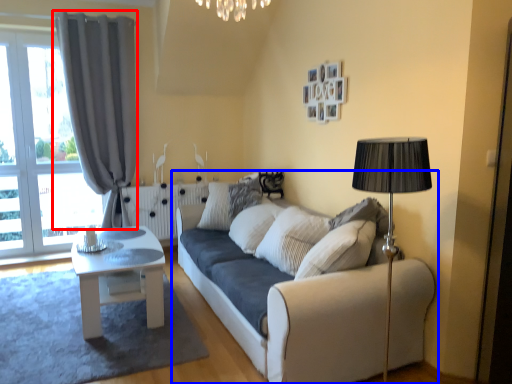
Question: Among these objects, which one is nearest to the camera, curtain (highlighted by a red box) or studio couch (highlighted by a blue box)?

Choices:
 (A) curtain
 (B) studio couch

Answer: (B)